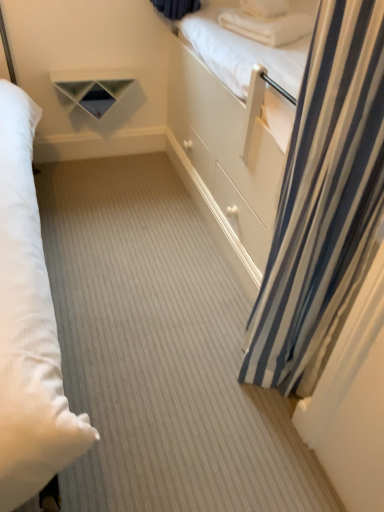
Question: Looking at their shapes, would you say blue striped curtain at right is wider or thinner than white soft pillow at upper right, acting as the first pillow starting from the top?

Choices:
 (A) thin
 (B) wide

Answer: (B)

Question: In terms of height, does blue striped curtain at right look taller or shorter compared to white soft pillow at upper right, acting as the first pillow starting from the top?

Choices:
 (A) tall
 (B) short

Answer: (A)

Question: Based on their relative distances, which object is farther from the white soft pillow at upper right, which appears as the second pillow when ordered from the bottom?

Choices:
 (A) white matte shelf at upper center
 (B) white soft pillow at upper right, which ranks as the 1th pillow in bottom-to-top order
 (C) blue striped curtain at right

Answer: (C)

Question: Which is farther from the white soft pillow at upper right, which ranks as the 1th pillow in bottom-to-top order?

Choices:
 (A) blue striped curtain at right
 (B) white matte shelf at upper center
 (C) white soft pillow at upper right, which appears as the second pillow when ordered from the bottom

Answer: (A)